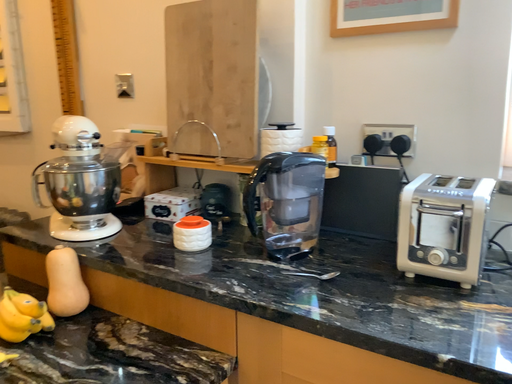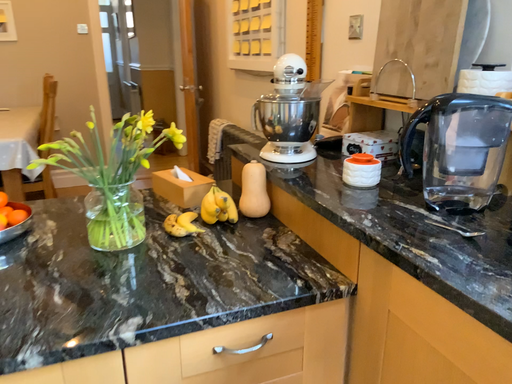
Question: Which way did the camera rotate in the video?

Choices:
 (A) rotated right
 (B) rotated left

Answer: (B)